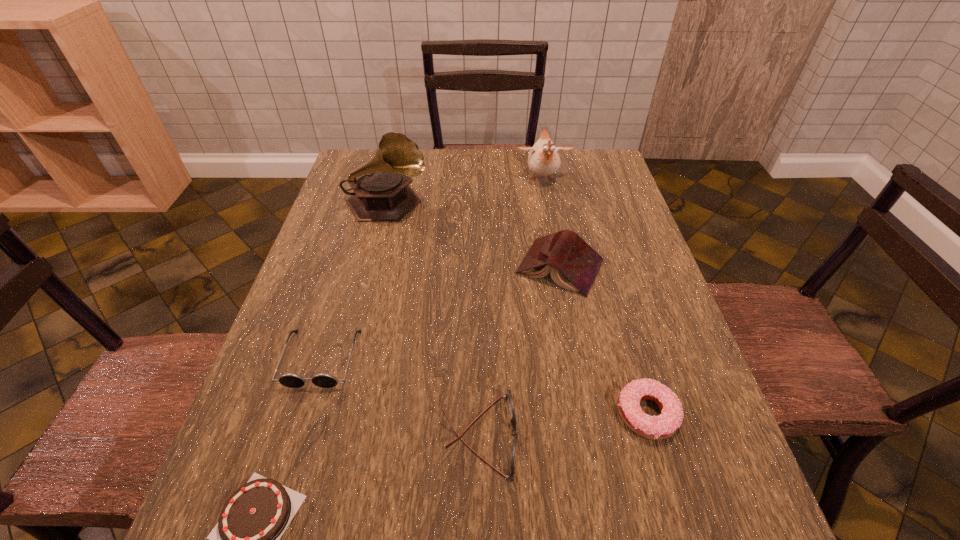
Identify the location of phonograph record. The image size is (960, 540). (382, 193).

Find the location of a particular element. bird is located at coordinates (543, 160).

Find the location of a particular element. the fifth nearest object is located at coordinates (574, 265).

This screenshot has width=960, height=540. In order to click on book in this screenshot , I will do `click(574, 265)`.

At what (x,y) coordinates should I click in order to perform the action: click on sunglasses. Please return your answer as a coordinate pair (x, y). This screenshot has width=960, height=540. Looking at the image, I should click on (291, 380).

You are a GUI agent. You are given a task and a screenshot of the screen. Output one action in this format:
    pyautogui.click(x=<x>, y=<y>)
    Task: Click on the spectacles
    This screenshot has width=960, height=540.
    Given the screenshot: What is the action you would take?
    pyautogui.click(x=508, y=396)

At what (x,y) coordinates should I click in order to perform the action: click on doughnut. Please return your answer as a coordinate pair (x, y). The image size is (960, 540). Looking at the image, I should click on (663, 426).

At what (x,y) coordinates should I click in order to perform the action: click on vacant space situated on the horn direction of the tallest object. Please return your answer as a coordinate pair (x, y). The width and height of the screenshot is (960, 540). Looking at the image, I should click on (514, 205).

Where is `vacant space located at the beak of the bird`? vacant space located at the beak of the bird is located at coordinates (554, 247).

The image size is (960, 540). Find the location of `vacant area located on the right of the fifth shortest object`. vacant area located on the right of the fifth shortest object is located at coordinates (644, 267).